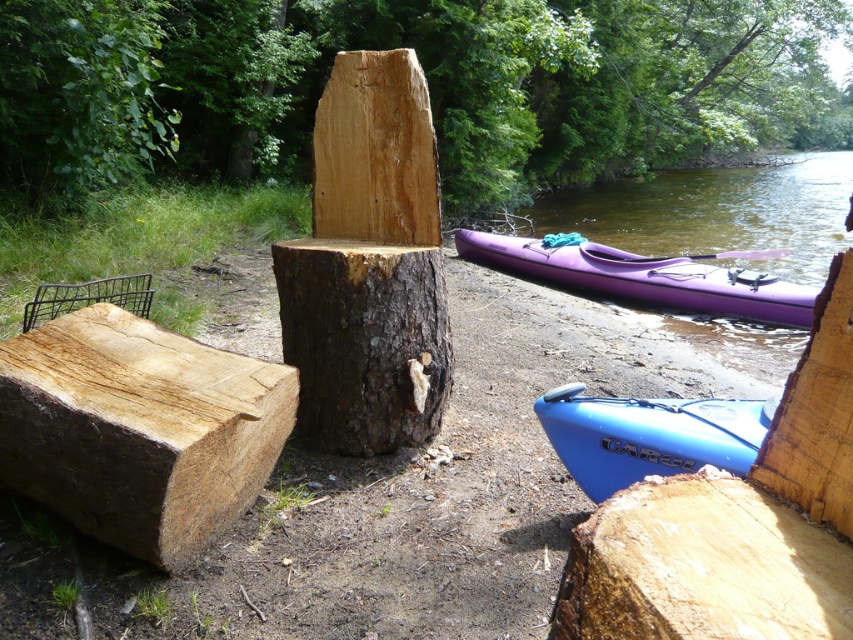
Question: Can you confirm if purple glossy kayak at right is positioned to the right of purple wood paddle at right?

Choices:
 (A) yes
 (B) no

Answer: (B)

Question: Which of the following is the farthest from the observer?

Choices:
 (A) natural wood log at center
 (B) wooden plank at right

Answer: (A)

Question: Is dark brown rough tree trunk at center below blue matte kayak at lower right?

Choices:
 (A) no
 (B) yes

Answer: (A)

Question: Which of the following is the closest to the observer?

Choices:
 (A) purple wood paddle at right
 (B) purple glossy kayak at right
 (C) blue matte kayak at lower right

Answer: (C)

Question: Which of these objects is positioned closest to the blue matte kayak at lower right?

Choices:
 (A) green leafy tree at upper left
 (B) natural wood log at center
 (C) purple wood paddle at right
 (D) dark brown rough tree trunk at center

Answer: (D)

Question: Can you confirm if natural wood log at center is wider than light brown wood at lower right?

Choices:
 (A) yes
 (B) no

Answer: (A)